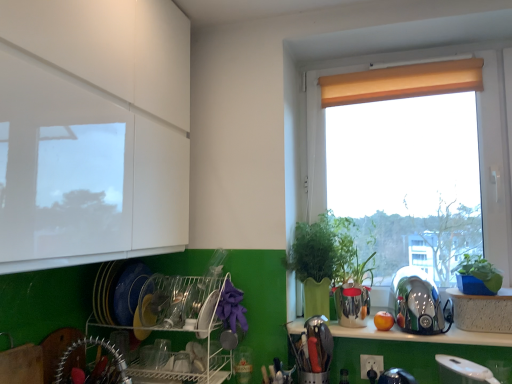
Find the location of a particular element. The height and width of the screenshot is (384, 512). free point below green plastic pot at right (from a real-world perspective) is located at coordinates (483, 294).